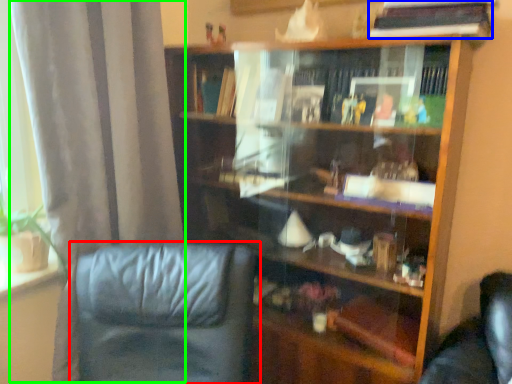
Question: Which object is the closest to the chair (highlighted by a red box)? Choose among these: book (highlighted by a blue box) or curtain (highlighted by a green box).

Choices:
 (A) book
 (B) curtain

Answer: (B)